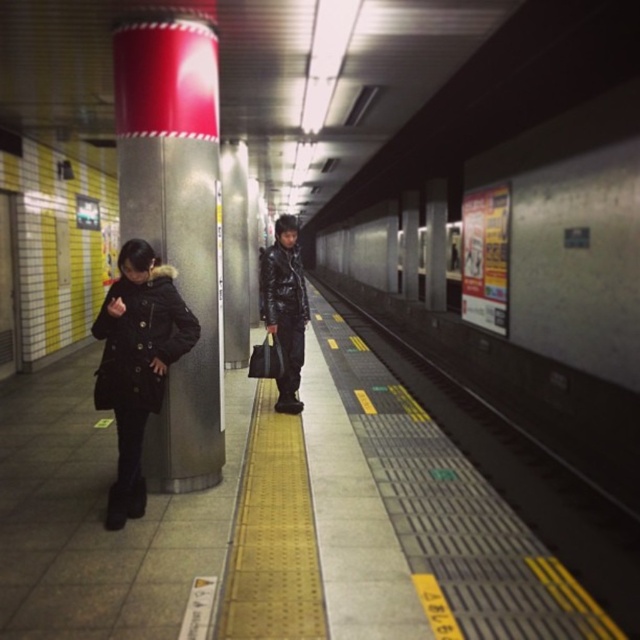
Question: Can you confirm if metallic silver train at center is bigger than black matte coat at left?

Choices:
 (A) yes
 (B) no

Answer: (A)

Question: Which object appears farthest from the camera in this image?

Choices:
 (A) metallic silver train at center
 (B) black matte coat at left
 (C) matte black coat at left
 (D) shiny black jacket at center

Answer: (D)

Question: Estimate the real-world distances between objects in this image. Which object is closer to the shiny black jacket at center?

Choices:
 (A) black matte coat at left
 (B) matte black coat at left
 (C) metallic silver train at center
 (D) metallic silver pillar at left

Answer: (D)

Question: Does metallic silver train at center appear over matte black coat at left?

Choices:
 (A) yes
 (B) no

Answer: (A)

Question: Which point is closer to the camera taking this photo?

Choices:
 (A) (128, 426)
 (B) (104, 385)
 (C) (586, 433)

Answer: (B)

Question: Can you confirm if metallic silver train at center is positioned below metallic silver pillar at left?

Choices:
 (A) yes
 (B) no

Answer: (B)